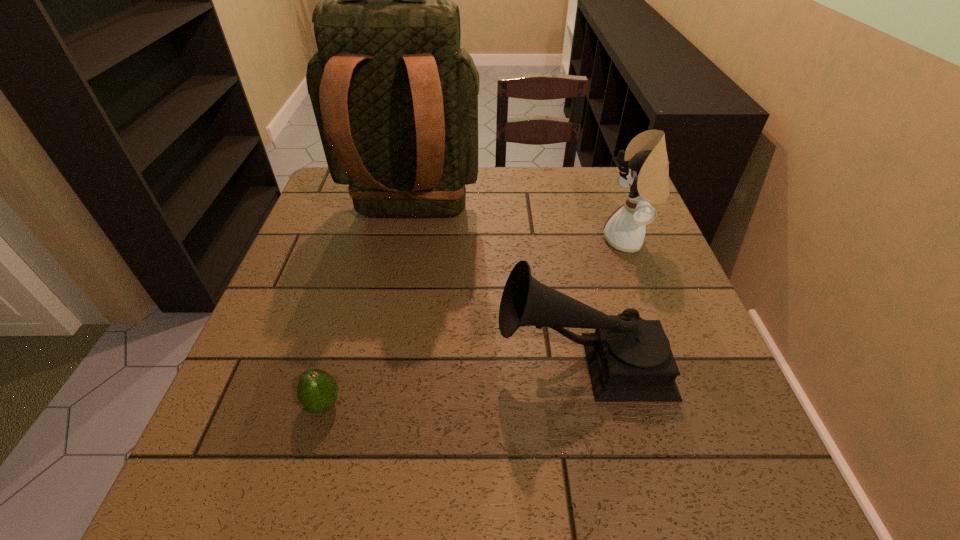
I want to click on vacant region located 0.060m from the horn of the phonograph_record, so click(x=467, y=360).

You are a GUI agent. You are given a task and a screenshot of the screen. Output one action in this format:
    pyautogui.click(x=<x>, y=<y>)
    Task: Click on the vacant space located 0.110m on the back of the avocado
    
    Given the screenshot: What is the action you would take?
    pyautogui.click(x=342, y=340)

This screenshot has height=540, width=960. Identify the location of object located at the far edge. (395, 99).

At what (x,y) coordinates should I click in order to perform the action: click on backpack at the left edge. Please return your answer as a coordinate pair (x, y). Looking at the image, I should click on (395, 99).

Find the location of a particular element. avocado located in the left edge section of the desktop is located at coordinates (317, 391).

Find the location of a particular element. This screenshot has width=960, height=540. doll that is at the right edge is located at coordinates (645, 171).

Image resolution: width=960 pixels, height=540 pixels. I want to click on phonograph_record present at the right edge, so click(x=630, y=360).

At what (x,y) coordinates should I click in order to perform the action: click on object located in the far left corner section of the desktop. Please return your answer as a coordinate pair (x, y). The image size is (960, 540). Looking at the image, I should click on (395, 99).

The image size is (960, 540). Identify the location of vacant space at the far edge. (556, 201).

In the image, there is a desktop. Where is `vacant region at the near edge`? Image resolution: width=960 pixels, height=540 pixels. vacant region at the near edge is located at coordinates [x=296, y=477].